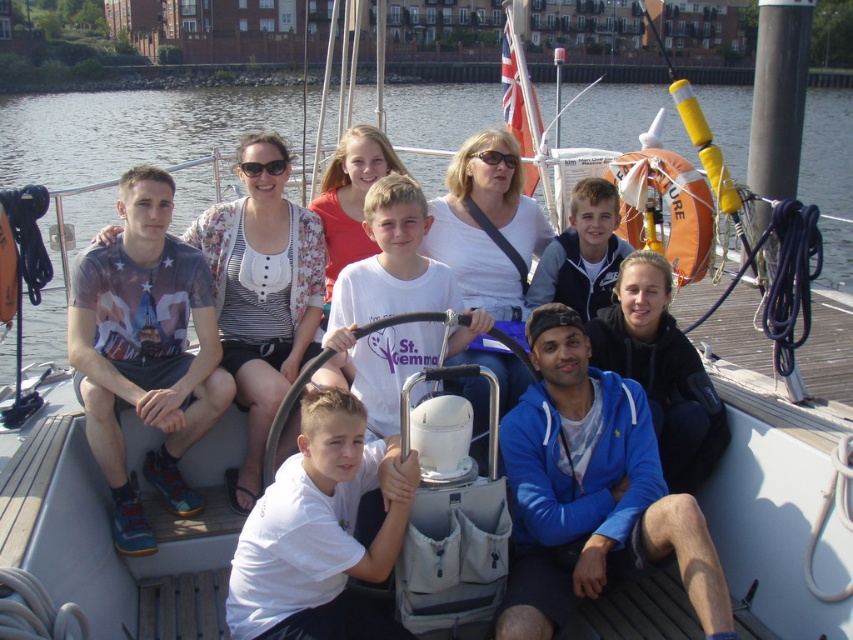
Question: Estimate the real-world distances between objects in this image. Which object is farther from the white matte shirt at center?

Choices:
 (A) blue fleece jacket at lower right
 (B) printed cotton t-shirt at left

Answer: (B)

Question: From the image, what is the correct spatial relationship of clear water at upper left in relation to blue fleece jacket at lower right?

Choices:
 (A) left
 (B) right

Answer: (B)

Question: Which of these objects is positioned closest to the printed cotton t-shirt at left?

Choices:
 (A) white matte shirt at center
 (B) clear water at upper left
 (C) blue fleece jacket at lower right

Answer: (A)

Question: Which point is farther to the camera?

Choices:
 (A) white matte shirt at center
 (B) printed cotton t-shirt at left

Answer: (B)

Question: Is printed cotton t-shirt at left above white matte shirt at center?

Choices:
 (A) no
 (B) yes

Answer: (B)

Question: Is clear water at upper left to the right of printed cotton t-shirt at left from the viewer's perspective?

Choices:
 (A) no
 (B) yes

Answer: (B)